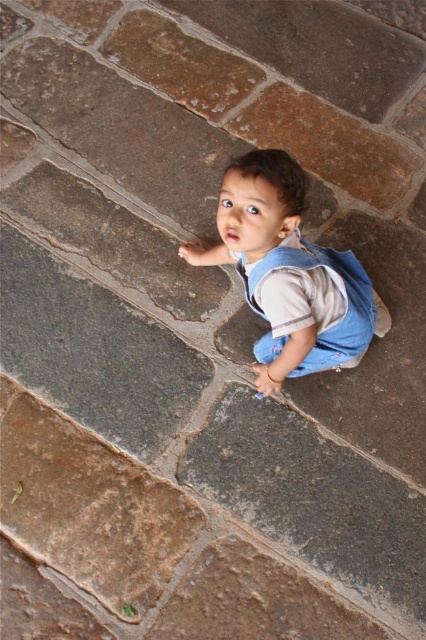
The child is wearing blue denim overalls at center. If the child wants to reach a toy placed 1.2 meters away from them, can they stretch their arms to grab it without moving their body?

The blue denim overalls at center are 1.25 meters apart from the toy. Since the distance is slightly more than the child can reach with their arms, they might need to move closer or use their legs to reach the toy.

You are a fashion designer observing a child wearing blue denim overalls at center and blue denim vest at center. Which piece of clothing is positioned more to the left?

The blue denim overalls at center are to the left of the blue denim vest at center.

The child is wearing a blue denim overalls at center and a blue denim vest at center. Which piece of clothing is longer?

The blue denim overalls at center is much taller than the blue denim vest at center, so the overalls are longer.